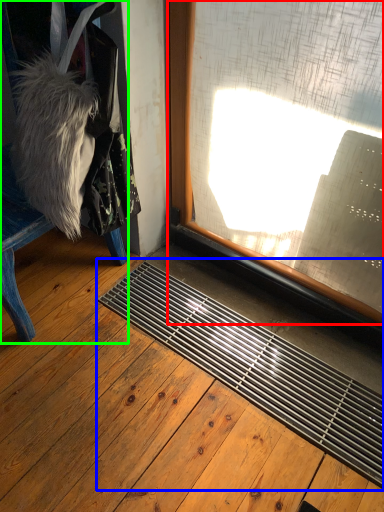
Question: Which object is the farthest from window (highlighted by a red box)? Choose among these: doormat (highlighted by a blue box) or furniture (highlighted by a green box).

Choices:
 (A) doormat
 (B) furniture

Answer: (B)